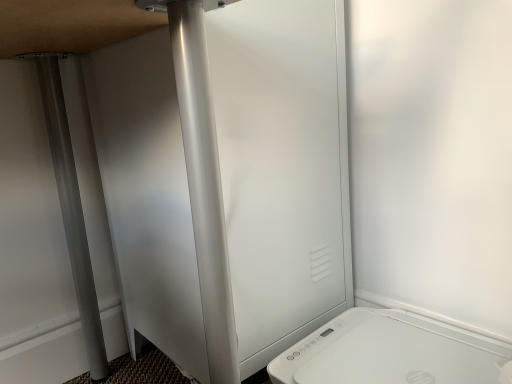
Question: Considering the relative positions of satin silver screen door at center and white plastic toaster at lower right in the image provided, is satin silver screen door at center to the left or to the right of white plastic toaster at lower right?

Choices:
 (A) left
 (B) right

Answer: (A)

Question: Considering the positions of satin silver screen door at center and white plastic toaster at lower right in the image, is satin silver screen door at center bigger or smaller than white plastic toaster at lower right?

Choices:
 (A) big
 (B) small

Answer: (A)

Question: From a real-world perspective, is satin silver screen door at center positioned above or below white plastic toaster at lower right?

Choices:
 (A) below
 (B) above

Answer: (B)

Question: Visually, is white plastic toaster at lower right positioned to the left or to the right of satin silver screen door at center?

Choices:
 (A) right
 (B) left

Answer: (A)

Question: Does point (478, 364) appear closer or farther from the camera than point (144, 261)?

Choices:
 (A) closer
 (B) farther

Answer: (A)

Question: Is white plastic toaster at lower right in front of or behind satin silver screen door at center in the image?

Choices:
 (A) front
 (B) behind

Answer: (A)

Question: Is white plastic toaster at lower right bigger or smaller than satin silver screen door at center?

Choices:
 (A) big
 (B) small

Answer: (B)